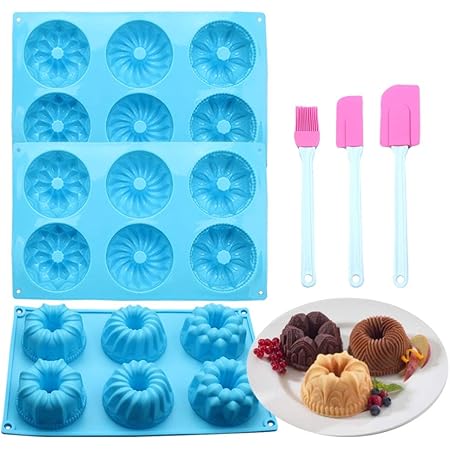
Locate an element on the screen. This screenshot has width=450, height=450. white handle is located at coordinates (309, 197), (356, 191), (401, 207).